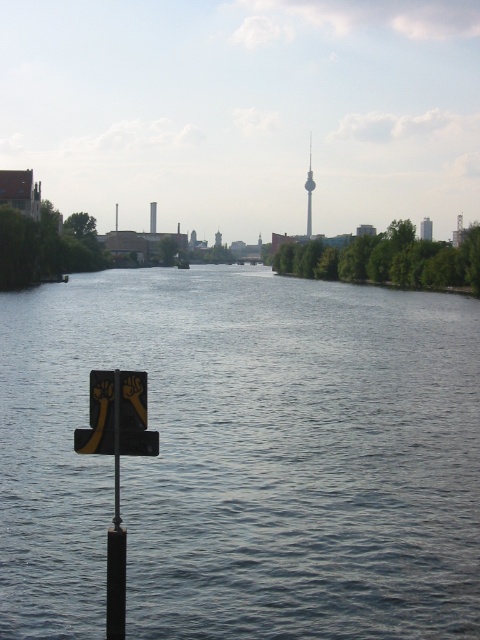
You are standing at the signpost on the left side of the frame. Looking towards the blue water at center, where would you see it in terms of direction and distance?

The blue water at center is located at coordinates point (243, 458), so it is positioned to the right and slightly forward from your current position at the signpost on the left side of the frame.